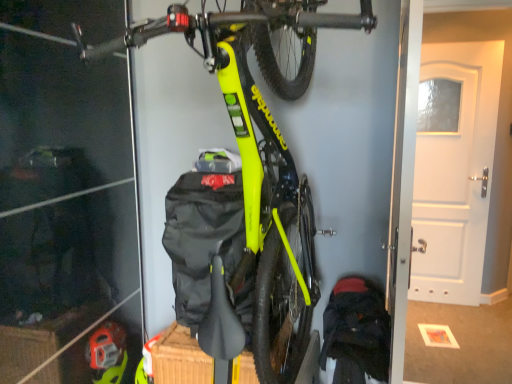
Question: Considering their positions, is neon yellow matte bicycle at center located in front of or behind dark blue fabric backpack at lower right?

Choices:
 (A) front
 (B) behind

Answer: (A)

Question: Looking at the image, does neon yellow matte bicycle at center seem bigger or smaller compared to dark blue fabric backpack at lower right?

Choices:
 (A) small
 (B) big

Answer: (B)

Question: Based on their relative distances, which object is nearer to the white matte door at upper right?

Choices:
 (A) dark blue fabric backpack at lower right
 (B) neon yellow matte bicycle at center

Answer: (A)

Question: Which object is positioned closest to the dark blue fabric backpack at lower right?

Choices:
 (A) neon yellow matte bicycle at center
 (B) white matte door at upper right

Answer: (A)